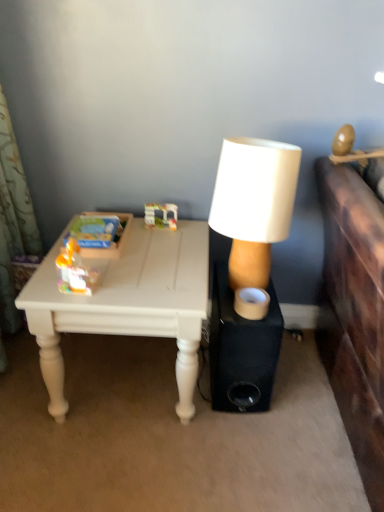
The height and width of the screenshot is (512, 384). I want to click on empty space that is ontop of white painted wood table at lower left (from a real-world perspective), so click(x=144, y=255).